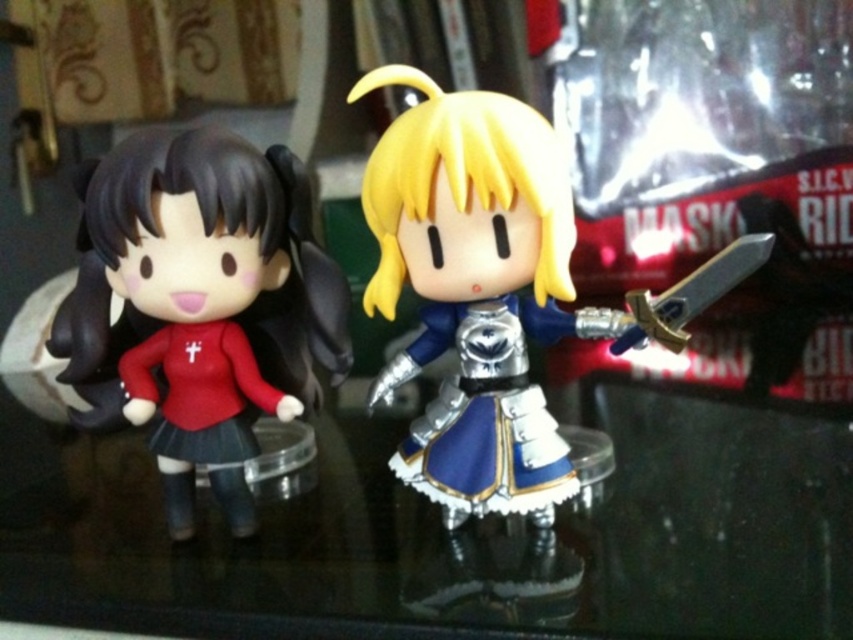
Question: Does shiny silver armor at center appear on the right side of matte red dress at left?

Choices:
 (A) yes
 (B) no

Answer: (A)

Question: Among these points, which one is farthest from the camera?

Choices:
 (A) (457, 93)
 (B) (292, 316)

Answer: (B)

Question: Is shiny silver armor at center wider than matte red dress at left?

Choices:
 (A) yes
 (B) no

Answer: (A)

Question: Can you confirm if matte red dress at left is positioned above shiny silver sword at right?

Choices:
 (A) yes
 (B) no

Answer: (B)

Question: Which point is farther to the camera?

Choices:
 (A) (494, 228)
 (B) (677, 282)
 (C) (344, 336)

Answer: (B)

Question: Which object appears farthest from the camera in this image?

Choices:
 (A) shiny silver sword at right
 (B) matte red dress at left

Answer: (B)